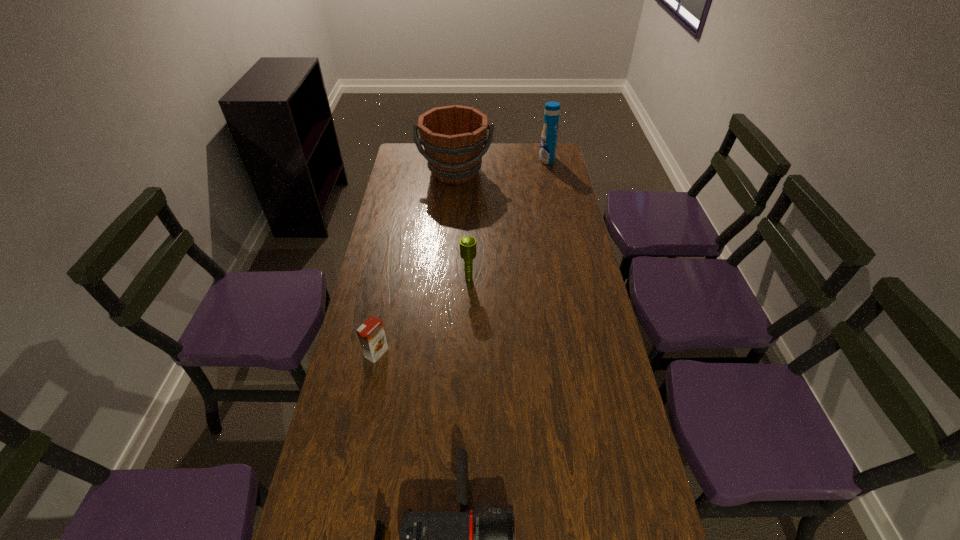
Locate which object is the third closest to the bucket. Please provide its 2D coordinates. Your answer should be formatted as a tuple, i.e. [(x, y)], where the tuple contains the x and y coordinates of a point satisfying the conditions above.

[(371, 334)]

Where is `vacant area in the image that satisfies the following two spatial constraints: 1. on the front-facing side of the detergent; 2. on the handle side of the bucket`? This screenshot has width=960, height=540. vacant area in the image that satisfies the following two spatial constraints: 1. on the front-facing side of the detergent; 2. on the handle side of the bucket is located at coordinates (549, 172).

The width and height of the screenshot is (960, 540). I want to click on vacant area that satisfies the following two spatial constraints: 1. on the handle side of the bucket; 2. on the left side of the third nearest object, so click(447, 279).

Image resolution: width=960 pixels, height=540 pixels. I want to click on vacant area in the image that satisfies the following two spatial constraints: 1. on the front-facing side of the rightmost object; 2. on the front side of the orange juice, so click(587, 353).

Where is `free spot that satisfies the following two spatial constraints: 1. on the handle side of the bucket; 2. on the left side of the third shortest object`? The image size is (960, 540). free spot that satisfies the following two spatial constraints: 1. on the handle side of the bucket; 2. on the left side of the third shortest object is located at coordinates (447, 279).

At what (x,y) coordinates should I click in order to perform the action: click on vacant space that satisfies the following two spatial constraints: 1. on the handle side of the bucket; 2. on the left side of the third farthest object. Please return your answer as a coordinate pair (x, y). Looking at the image, I should click on (447, 279).